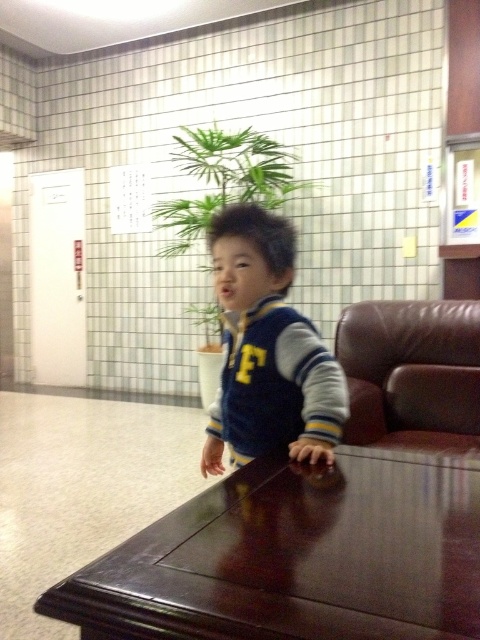
Is dark brown polished wood table at center to the right of blue fleece jacket at center from the viewer's perspective?

Correct, you'll find dark brown polished wood table at center to the right of blue fleece jacket at center.

Can you confirm if dark brown polished wood table at center is shorter than blue fleece jacket at center?

Correct, dark brown polished wood table at center is not as tall as blue fleece jacket at center.

Between point (347, 616) and point (322, 387), which one is positioned in front?

Positioned in front is point (347, 616).

The height and width of the screenshot is (640, 480). I want to click on dark brown polished wood table at center, so click(x=297, y=556).

Between dark brown polished wood table at center and brown leather armchair at right, which one is positioned higher?

Positioned higher is brown leather armchair at right.

Is dark brown polished wood table at center thinner than brown leather armchair at right?

No.

Identify the location of dark brown polished wood table at center. point(297,556).

Between point (238, 403) and point (381, 362), which one is positioned in front?

Positioned in front is point (238, 403).

Is point (304, 352) behind point (357, 388)?

No, (304, 352) is closer to viewer.

Identify the location of blue fleece jacket at center. (267, 349).